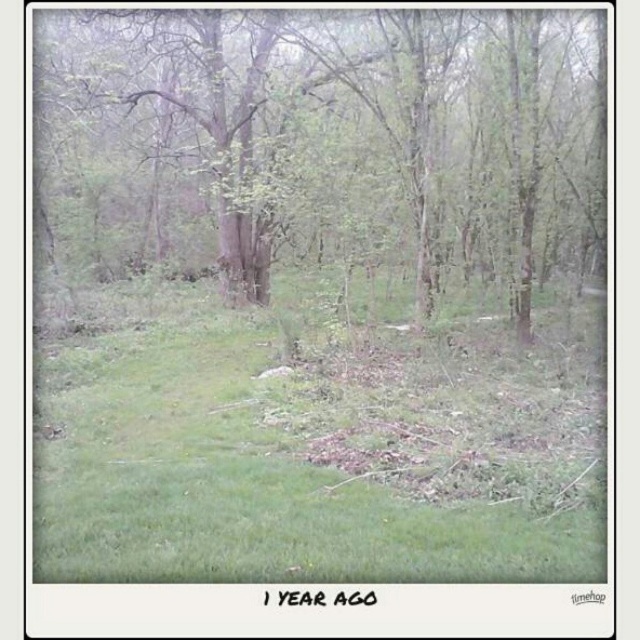
Between green grassy at center and green leafy tree at center, which one appears on the right side from the viewer's perspective?

green grassy at center

Which is behind, point (145, 371) or point (378, 221)?

Point (378, 221)

Between point (289, 529) and point (550, 228), which one is positioned in front?

Positioned in front is point (289, 529).

Find the location of a particular element. This screenshot has height=640, width=640. green grassy at center is located at coordinates (314, 436).